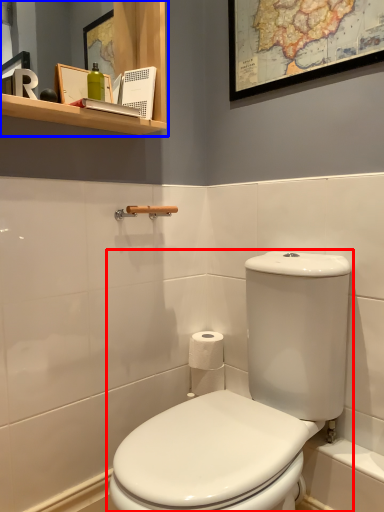
Question: Which object is further to the camera taking this photo, toilet (highlighted by a red box) or bathroom cabinet (highlighted by a blue box)?

Choices:
 (A) toilet
 (B) bathroom cabinet

Answer: (B)